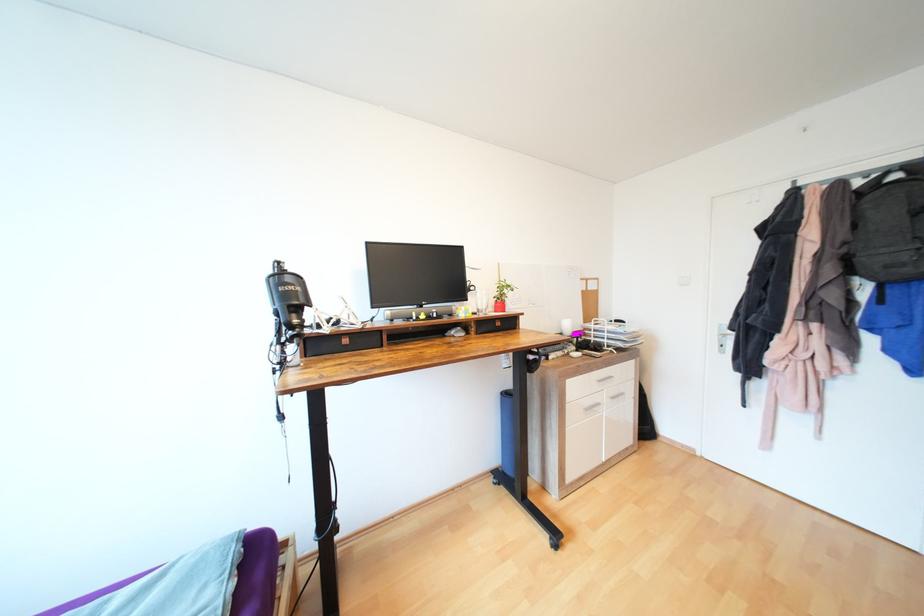
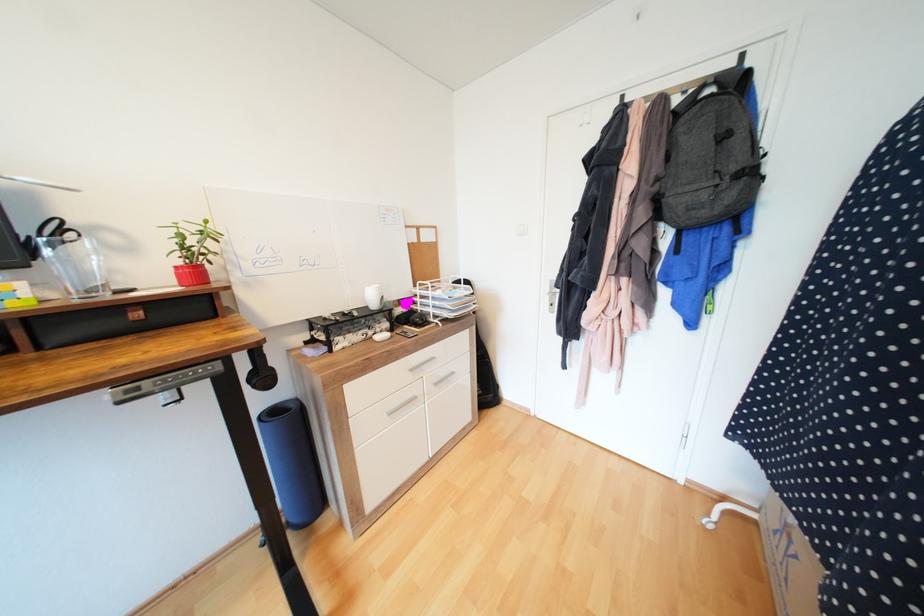
Question: How did the camera likely rotate?

Choices:
 (A) Left
 (B) Right
 (C) Up
 (D) Down

Answer: (B)